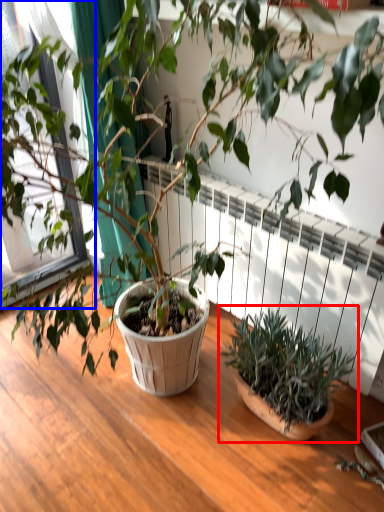
Question: Which object is further to the camera taking this photo, houseplant (highlighted by a red box) or window frame (highlighted by a blue box)?

Choices:
 (A) houseplant
 (B) window frame

Answer: (B)